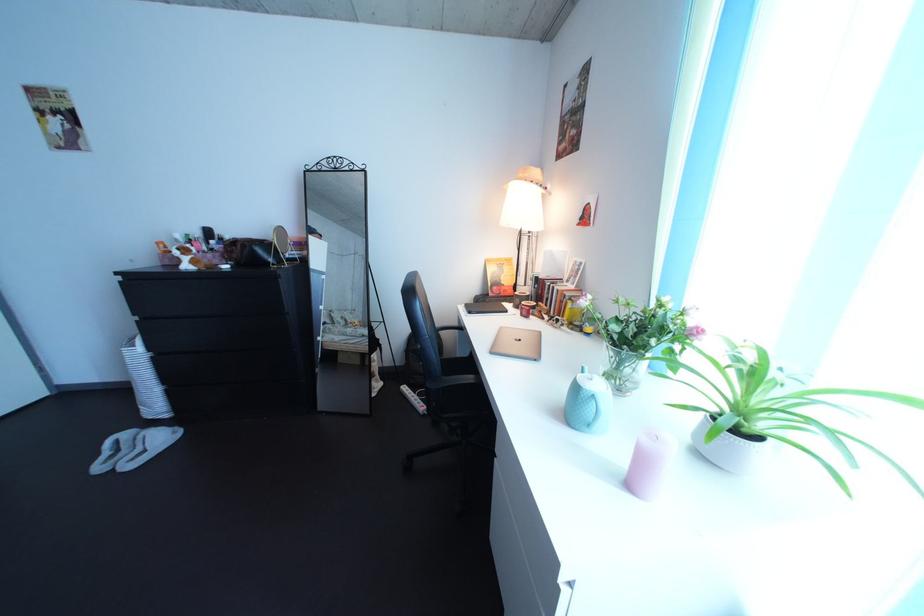
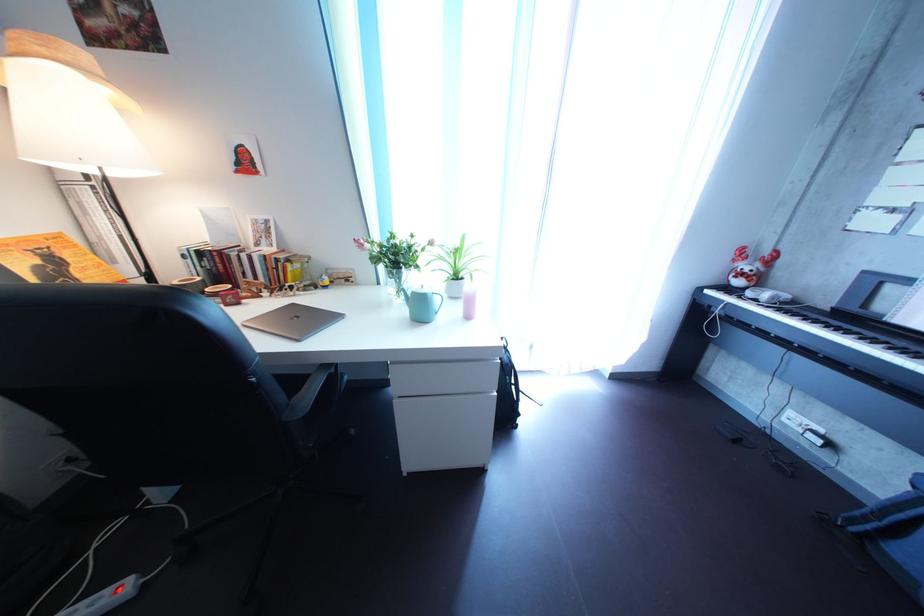
In the second image, find the point that corresponds to the point at 554,341 in the first image.

(308, 313)